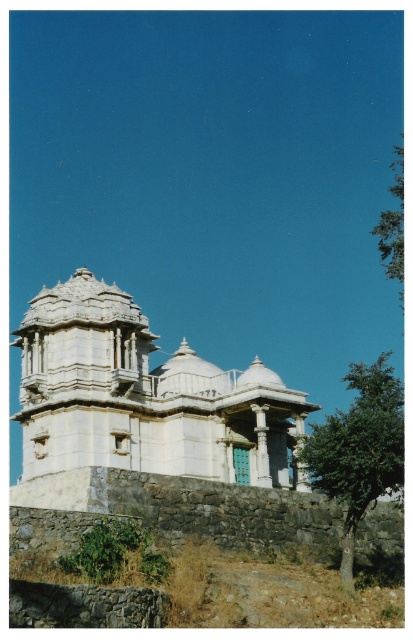
From the picture: You are standing in front of a historical monument with a central dome surrounded by smaller domes and spires. There is a specific point marked at coordinates point (291, 426). Given that you are 276.14 feet away from this point, can you estimate how far you are from the green door located on the monument?

The distance between you and the point (291, 426) is 276.14 feet. However, the question asks about the distance to the green door, which isn not mentioned in the provided information. Therefore, it is impossible to determine the distance to the green door based on the given data.

You are an architect analyzing the symmetry of the temple. You notice two green leafy trees in the image. Which tree, the green leafy tree at lower right or the green leafy tree at upper right, is larger in size?

The green leafy tree at upper right is larger than the green leafy tree at lower right.